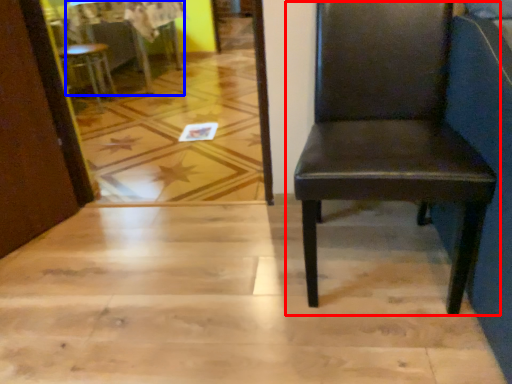
Question: Which of the following is the closest to the observer, chair (highlighted by a red box) or table (highlighted by a blue box)?

Choices:
 (A) chair
 (B) table

Answer: (A)